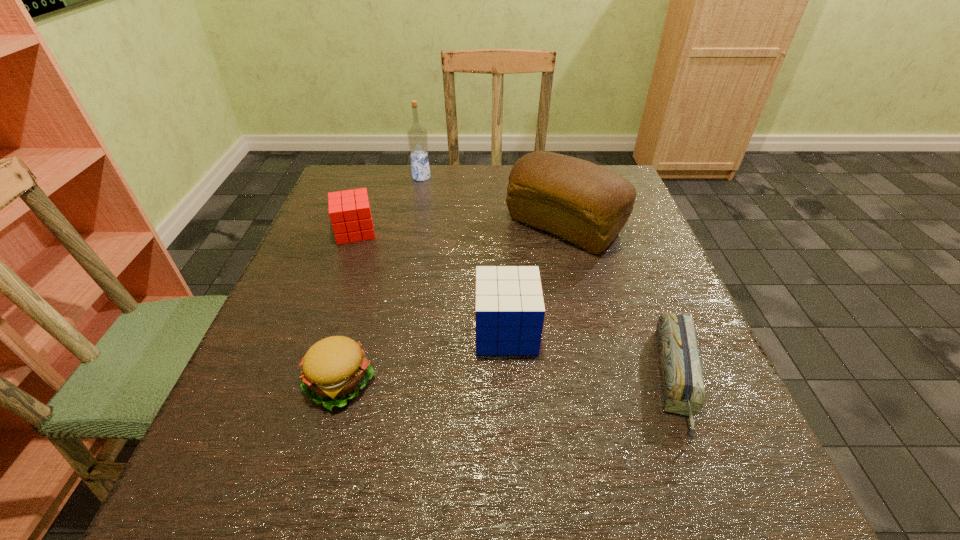
The image size is (960, 540). Find the location of `vacant space situated 0.130m on the left of the second tallest object`. vacant space situated 0.130m on the left of the second tallest object is located at coordinates (452, 226).

You are a GUI agent. You are given a task and a screenshot of the screen. Output one action in this format:
    pyautogui.click(x=<x>, y=<y>)
    Task: Click on the free space located on the left of the nearer cube
    This screenshot has width=960, height=540.
    Given the screenshot: What is the action you would take?
    pyautogui.click(x=331, y=332)

I want to click on vacant space located on the back of the shorter cube, so click(x=375, y=174).

I want to click on free space located 0.090m on the left of the hamburger, so click(x=251, y=383).

Image resolution: width=960 pixels, height=540 pixels. In order to click on blank space located 0.070m on the front of the pencil box in this screenshot , I will do `click(722, 492)`.

Find the location of a particular element. vodka that is positioned at the far edge is located at coordinates point(417,136).

I want to click on bread that is at the far edge, so click(x=588, y=205).

The width and height of the screenshot is (960, 540). Identify the location of cube at the left edge. (350, 215).

Locate an element on the screen. This screenshot has height=540, width=960. hamburger located at the left edge is located at coordinates (334, 369).

Where is `bread situated at the right edge`? Image resolution: width=960 pixels, height=540 pixels. bread situated at the right edge is located at coordinates (588, 205).